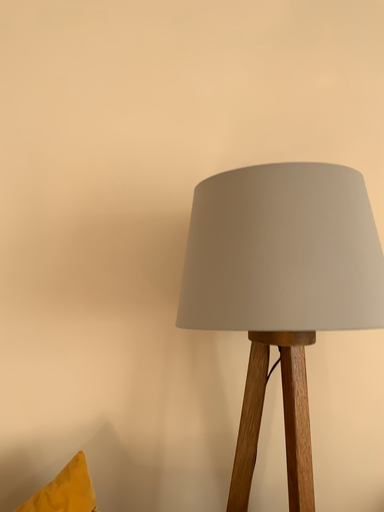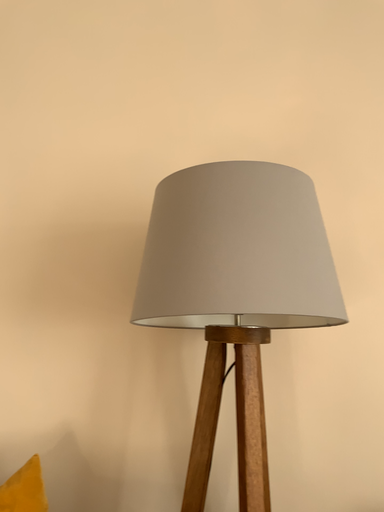
Question: How did the camera likely rotate when shooting the video?

Choices:
 (A) rotated downward
 (B) rotated upward

Answer: (B)